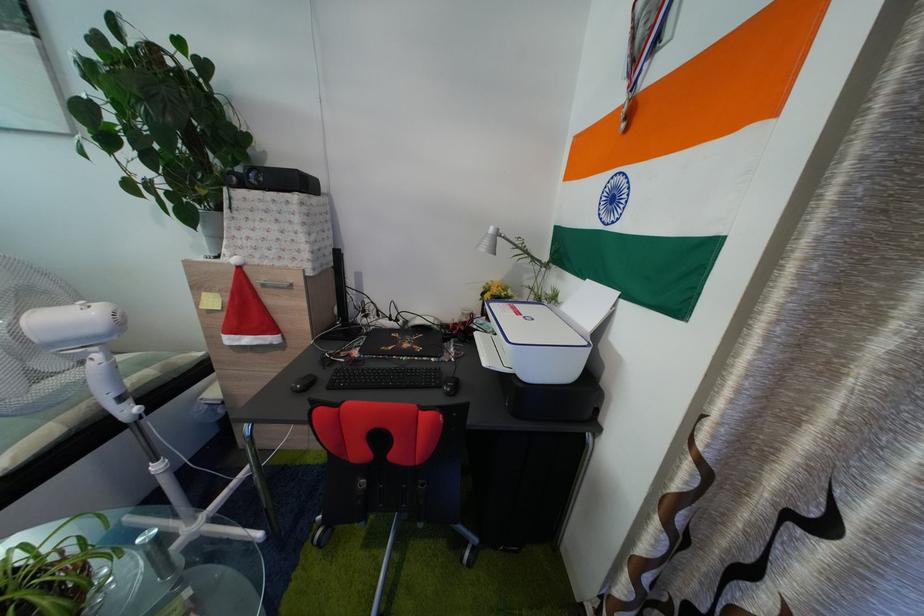
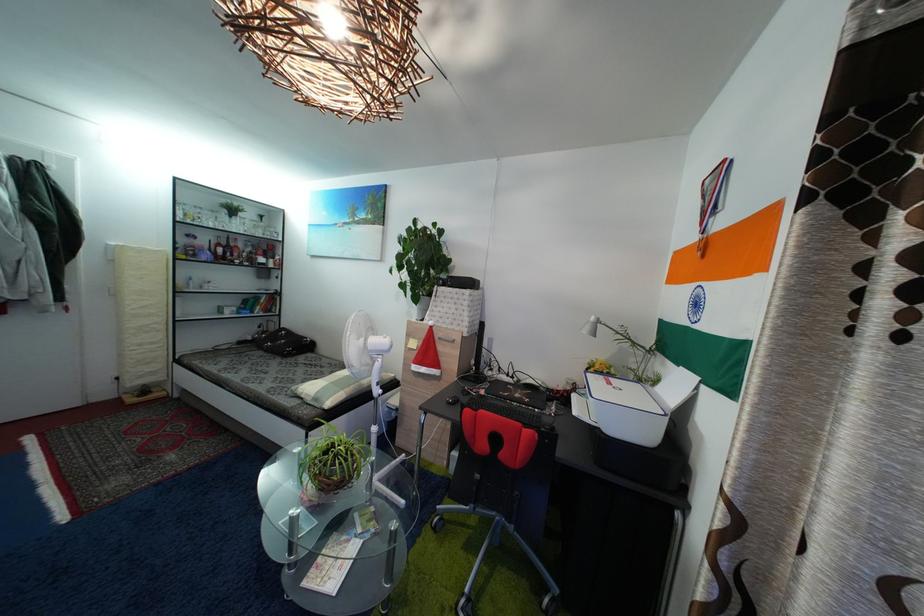
The point at (492, 302) is marked in the first image. Where is the corresponding point in the second image?

(596, 377)